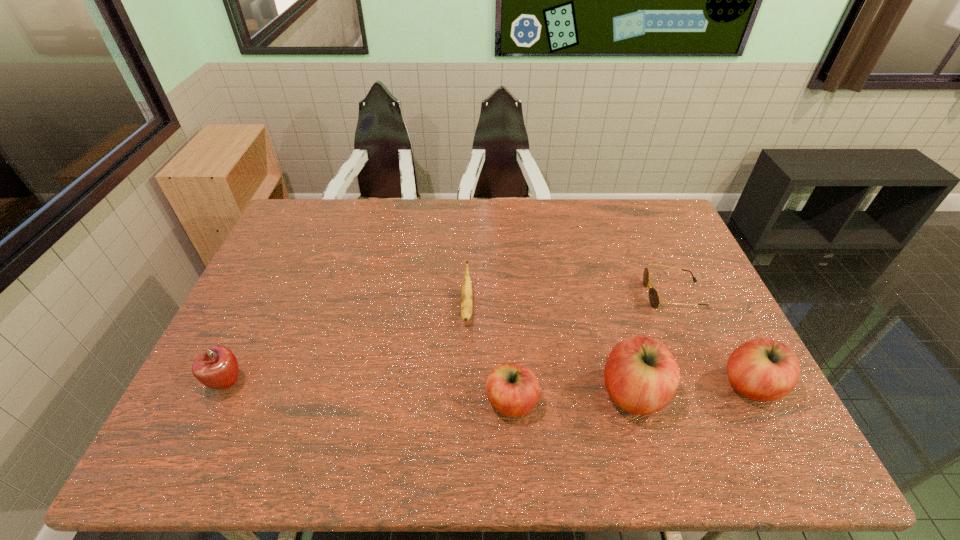
Locate an element on the screen. Image resolution: width=960 pixels, height=540 pixels. vacant space that's between the third apple from right to left and the shortest object is located at coordinates (592, 348).

Image resolution: width=960 pixels, height=540 pixels. In order to click on free spot between the third apple from right to left and the fourth object from left to right in this screenshot , I will do `click(572, 397)`.

At what (x,y) coordinates should I click in order to perform the action: click on free area in between the shortest object and the leftmost object. Please return your answer as a coordinate pair (x, y). This screenshot has height=540, width=960. Looking at the image, I should click on (451, 339).

Locate an element on the screen. The image size is (960, 540). free area in between the banana and the fourth object from right to left is located at coordinates (490, 354).

The height and width of the screenshot is (540, 960). I want to click on the second closest object relative to the fourth object from left to right, so click(513, 390).

The width and height of the screenshot is (960, 540). What are the coordinates of `the closest object to the leftmost apple` in the screenshot? It's located at (466, 299).

Locate which apple is the third closest to the rightmost apple. Please provide its 2D coordinates. Your answer should be formatted as a tuple, i.e. [(x, y)], where the tuple contains the x and y coordinates of a point satisfying the conditions above.

[(217, 367)]

Select which apple appears as the third closest to the third object from right to left. Please provide its 2D coordinates. Your answer should be formatted as a tuple, i.e. [(x, y)], where the tuple contains the x and y coordinates of a point satisfying the conditions above.

[(217, 367)]

Locate an element on the screen. free space that satisfies the following two spatial constraints: 1. on the back side of the third shortest apple; 2. on the right side of the third object from right to left is located at coordinates (631, 385).

Where is `vacant space that satisfies the following two spatial constraints: 1. on the peel of the second object from left to right from the top; 2. on the right side of the second tallest apple`? vacant space that satisfies the following two spatial constraints: 1. on the peel of the second object from left to right from the top; 2. on the right side of the second tallest apple is located at coordinates (465, 385).